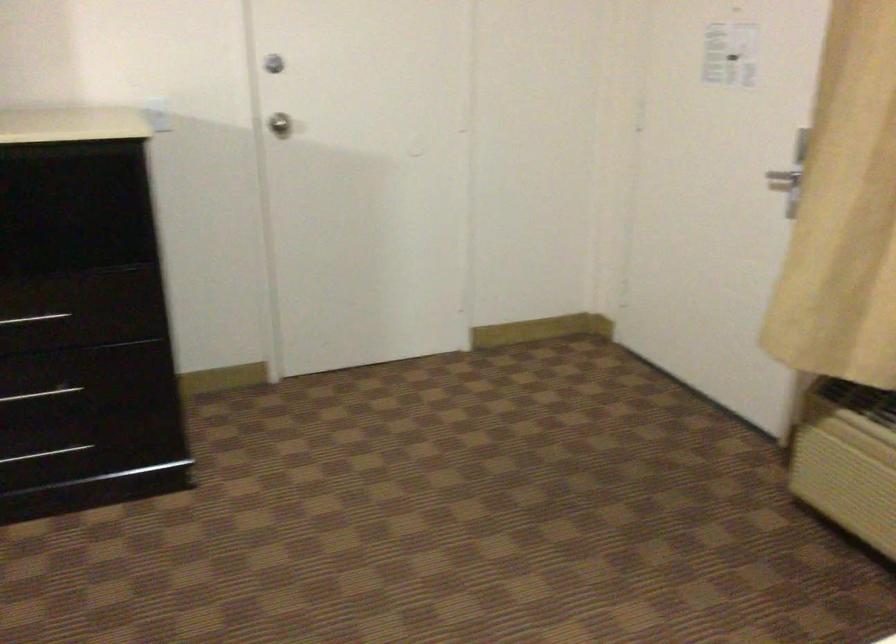
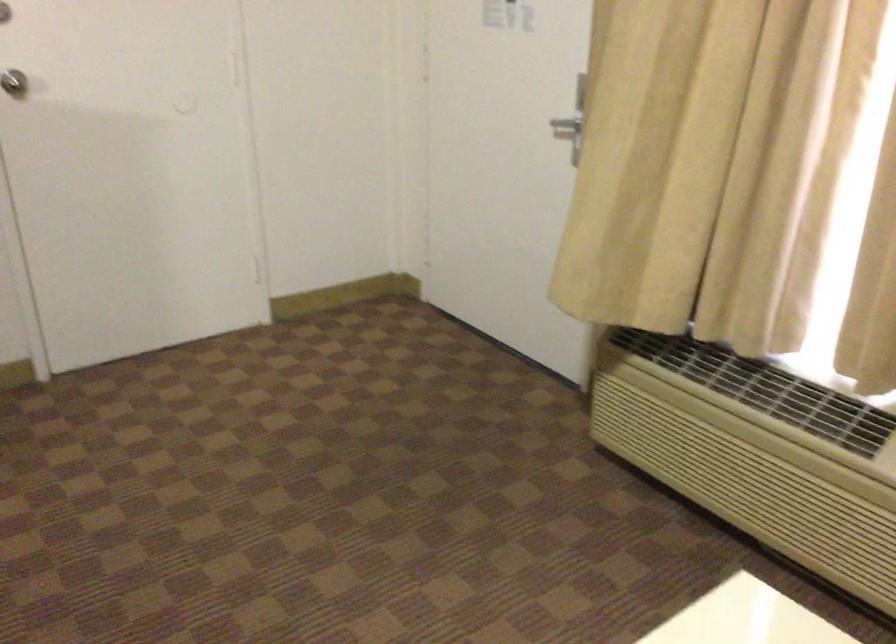
In the second image, find the point that corresponds to (x=271, y=126) in the first image.

(13, 82)